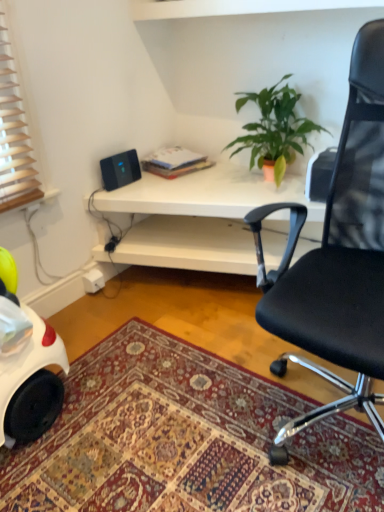
Question: Is black plastic speaker at upper left smaller than black mesh office chair at upper right?

Choices:
 (A) yes
 (B) no

Answer: (A)

Question: Is black plastic speaker at upper left next to black mesh office chair at upper right?

Choices:
 (A) yes
 (B) no

Answer: (B)

Question: Is black plastic speaker at upper left turned away from black mesh office chair at upper right?

Choices:
 (A) yes
 (B) no

Answer: (B)

Question: Can you confirm if black plastic speaker at upper left is positioned to the left of black mesh office chair at upper right?

Choices:
 (A) no
 (B) yes

Answer: (B)

Question: Does black plastic speaker at upper left have a larger size compared to black mesh office chair at upper right?

Choices:
 (A) yes
 (B) no

Answer: (B)

Question: Does point (271, 125) appear closer or farther from the camera than point (375, 371)?

Choices:
 (A) closer
 (B) farther

Answer: (B)

Question: In the image, is green matte plant at upper center positioned in front of or behind black mesh office chair at upper right?

Choices:
 (A) front
 (B) behind

Answer: (B)

Question: Is green matte plant at upper center wider or thinner than black mesh office chair at upper right?

Choices:
 (A) thin
 (B) wide

Answer: (A)

Question: From the image's perspective, is green matte plant at upper center located above or below black mesh office chair at upper right?

Choices:
 (A) below
 (B) above

Answer: (B)

Question: Considering the positions of green matte plant at upper center and carpeted rug at lower center in the image, is green matte plant at upper center wider or thinner than carpeted rug at lower center?

Choices:
 (A) wide
 (B) thin

Answer: (B)

Question: Would you say green matte plant at upper center is to the left or to the right of carpeted rug at lower center in the picture?

Choices:
 (A) right
 (B) left

Answer: (A)

Question: From the image's perspective, relative to carpeted rug at lower center, is green matte plant at upper center above or below?

Choices:
 (A) below
 (B) above

Answer: (B)

Question: Is green matte plant at upper center situated inside carpeted rug at lower center or outside?

Choices:
 (A) inside
 (B) outside

Answer: (B)

Question: Considering the positions of carpeted rug at lower center and black plastic speaker at upper left in the image, is carpeted rug at lower center wider or thinner than black plastic speaker at upper left?

Choices:
 (A) wide
 (B) thin

Answer: (A)

Question: Considering the relative positions of carpeted rug at lower center and black plastic speaker at upper left in the image provided, is carpeted rug at lower center to the left or to the right of black plastic speaker at upper left?

Choices:
 (A) right
 (B) left

Answer: (A)